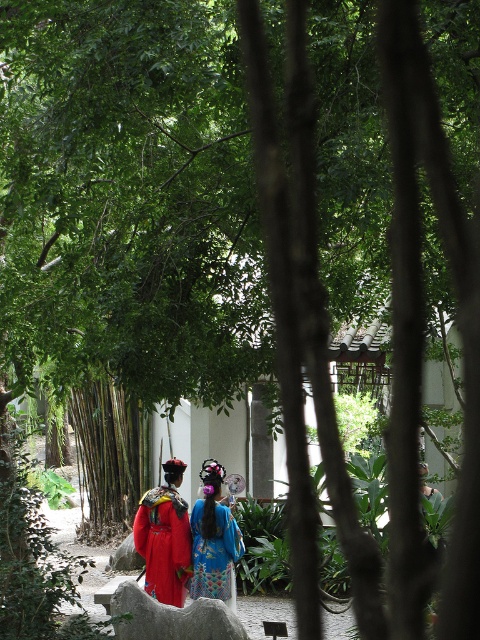
You are standing in a traditional garden and see a point marked at coordinates (164,544). Which object from the scene is located at this point?

The point at coordinates (164,544) corresponds to the red satin robe at center.

You are an artist planning to paint the scene. You want to ensure the blue silk dress at center is wider than the green bamboo forest at center in your painting. Is this possible based on the actual scene?

The green bamboo forest at center is narrower than the blue silk dress at center in the actual scene, so you can paint the blue silk dress at center wider than the green bamboo forest at center as desired.

You are an artist planning to paint the scene in front of you. You notice the green bamboo forest at center and the blue silk dress at center. Which object should you depict as smaller in your painting to maintain accuracy?

The green bamboo forest at center should be depicted as smaller compared to the blue silk dress at center to maintain accuracy.